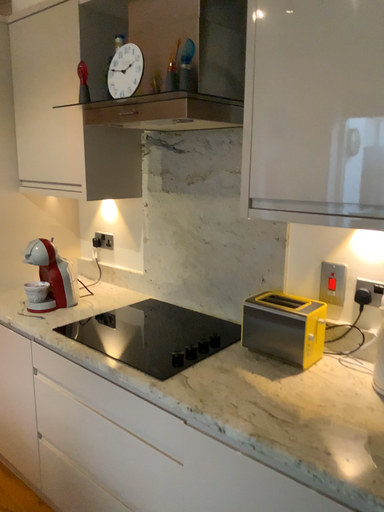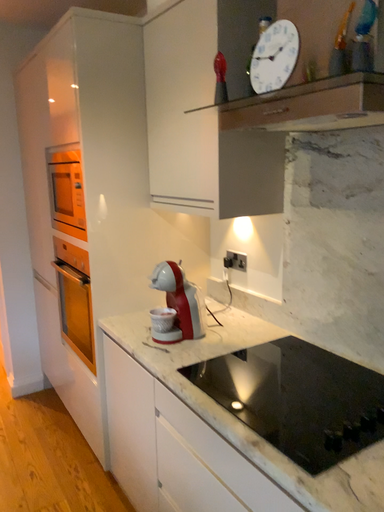
Question: How did the camera likely rotate when shooting the video?

Choices:
 (A) rotated left
 (B) rotated right

Answer: (A)